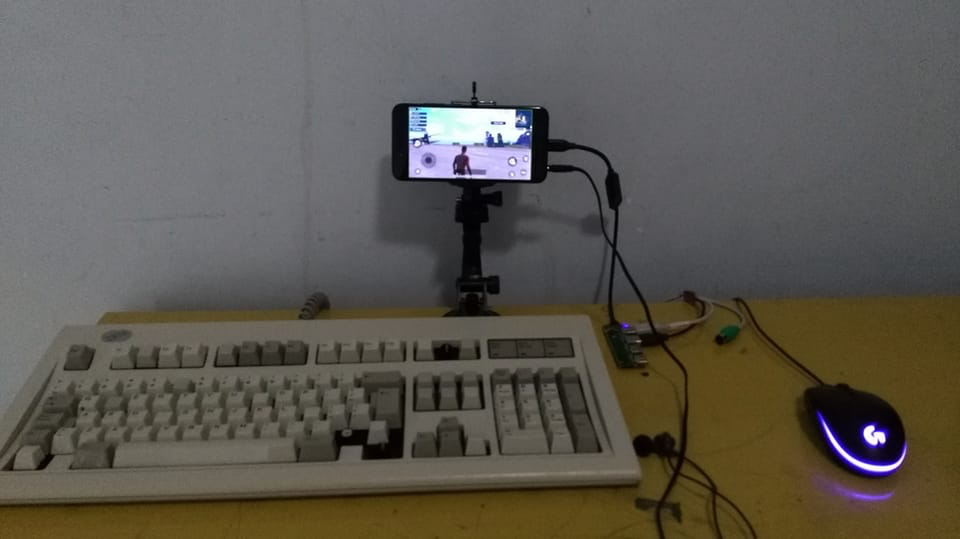
Where is `wall`? wall is located at coordinates (694, 116).